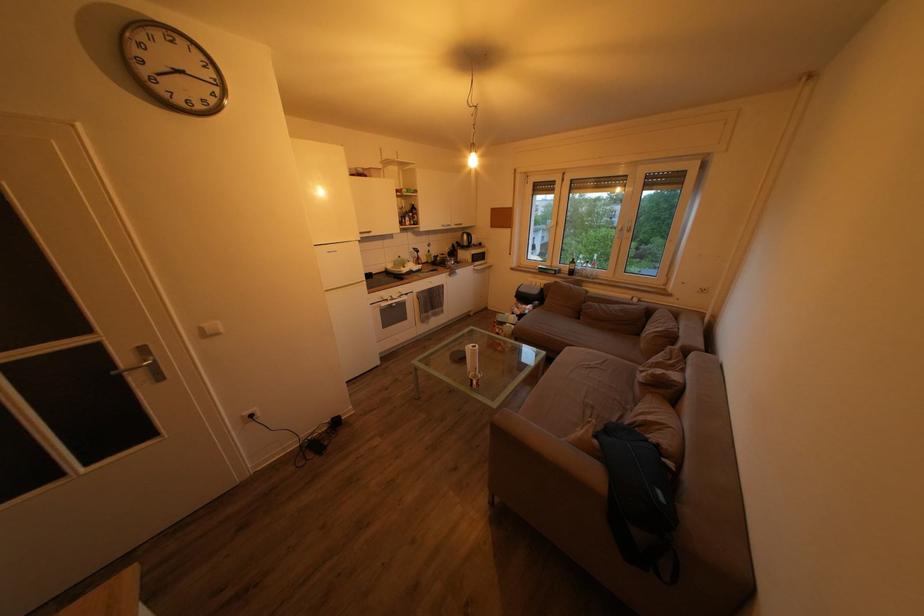
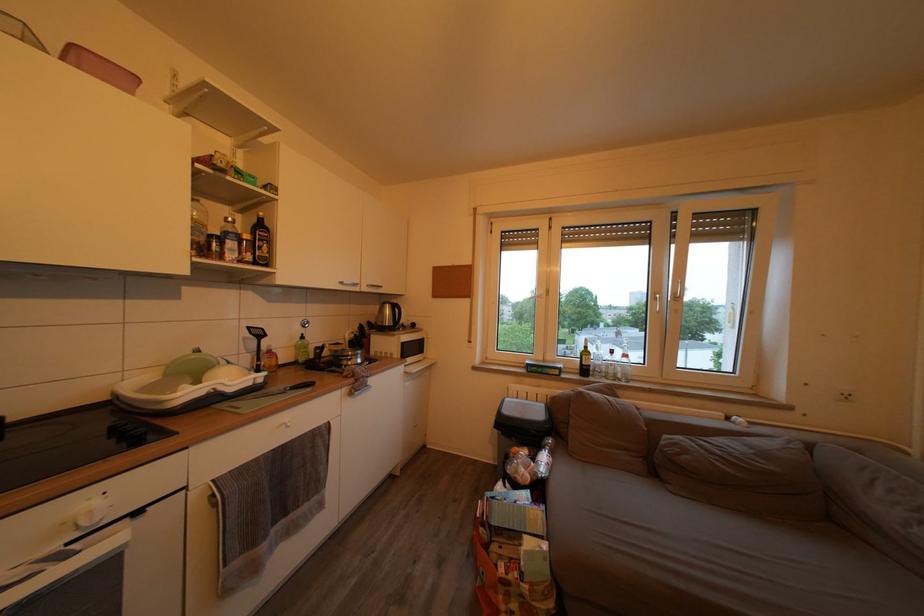
Where in the second image is the point corresponding to [419,221] from the first image?

(253, 243)